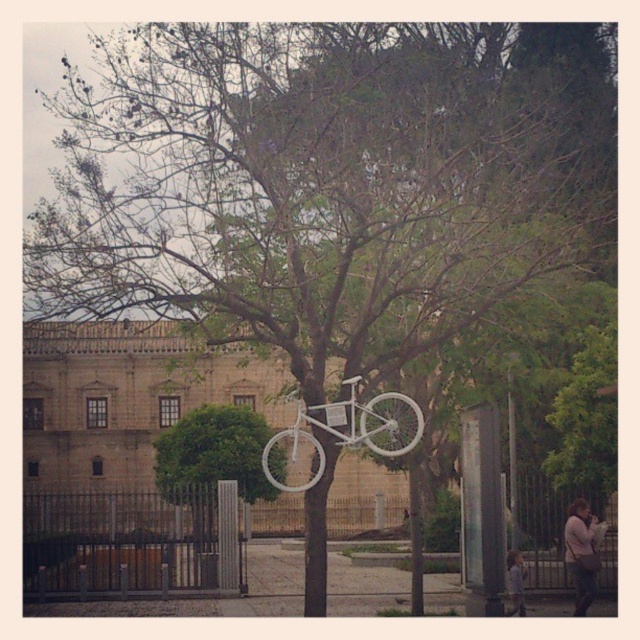
Question: Considering the relative positions of green leafy tree at center and white matte bicycle at center in the image provided, where is green leafy tree at center located with respect to white matte bicycle at center?

Choices:
 (A) below
 (B) above

Answer: (A)

Question: Does green leafy tree at center appear on the left side of white matte bicycle at center?

Choices:
 (A) yes
 (B) no

Answer: (A)

Question: Which point appears closest to the camera in this image?

Choices:
 (A) (381, 454)
 (B) (416, 536)

Answer: (B)

Question: Is green leafy tree at center behind white matte bicycle at center?

Choices:
 (A) no
 (B) yes

Answer: (B)

Question: Estimate the real-world distances between objects in this image. Which object is farther from the green leafy tree at center?

Choices:
 (A) metallic pole at center
 (B) white matte bicycle at center

Answer: (A)

Question: Which point is farther to the camera?

Choices:
 (A) green leafy tree at center
 (B) metallic pole at center
 (C) white matte bicycle at center

Answer: (A)